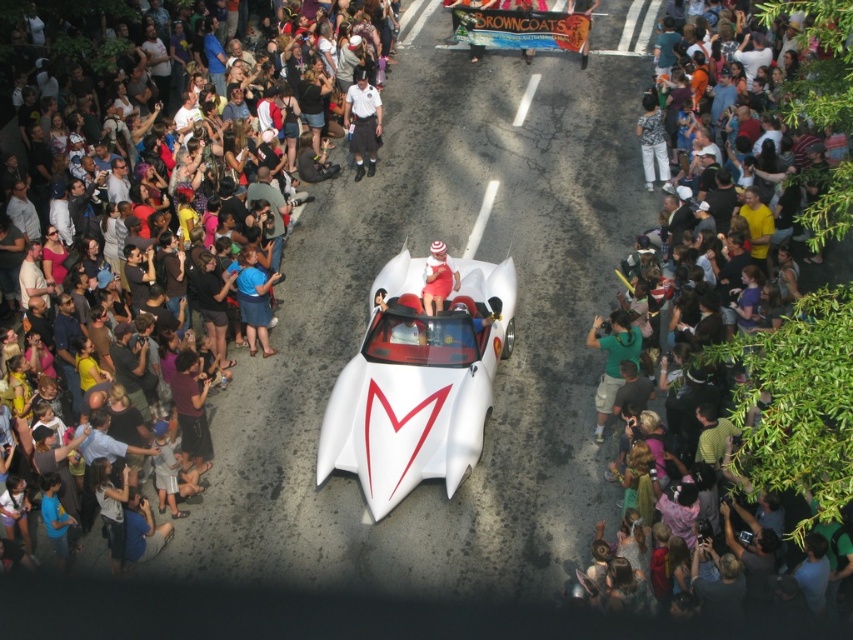
Which is more to the left, white matte sports car at center or matte red dress at center?

matte red dress at center

Who is positioned more to the right, white matte sports car at center or matte red dress at center?

white matte sports car at center is more to the right.

Between point (399, 257) and point (426, 298), which one is positioned in front?

Positioned in front is point (426, 298).

Locate an element on the screen. The height and width of the screenshot is (640, 853). white matte sports car at center is located at coordinates pos(418,380).

What do you see at coordinates (418, 380) in the screenshot?
I see `white matte sports car at center` at bounding box center [418, 380].

Does white matte sports car at center have a smaller size compared to dark clothing crowd at center?

Incorrect, white matte sports car at center is not smaller in size than dark clothing crowd at center.

Measure the distance between white matte sports car at center and camera.

white matte sports car at center and camera are 14.84 meters apart.

You are a GUI agent. You are given a task and a screenshot of the screen. Output one action in this format:
    pyautogui.click(x=<x>, y=<y>)
    Task: Click on the white matte sports car at center
    The height and width of the screenshot is (640, 853).
    Given the screenshot: What is the action you would take?
    pyautogui.click(x=418, y=380)

Which is below, matte black crowd at center or white uniform at center?

matte black crowd at center

Between point (328, 240) and point (358, 129), which one is positioned behind?

Point (358, 129)

Does point (289, 268) come behind point (375, 92)?

That is False.

Locate an element on the screen. matte black crowd at center is located at coordinates (302, 387).